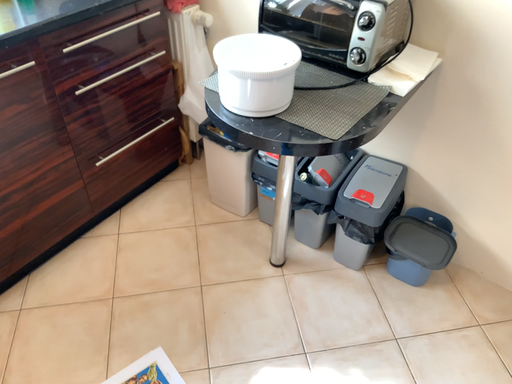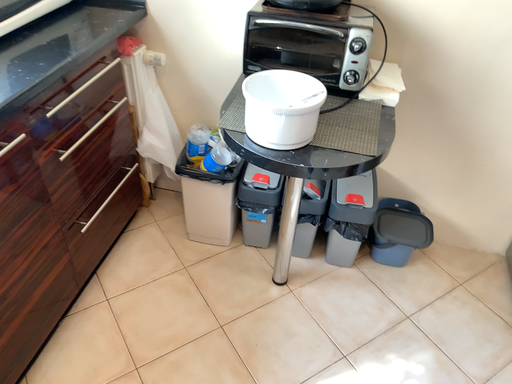
Question: How did the camera likely rotate when shooting the video?

Choices:
 (A) rotated right
 (B) rotated left

Answer: (A)